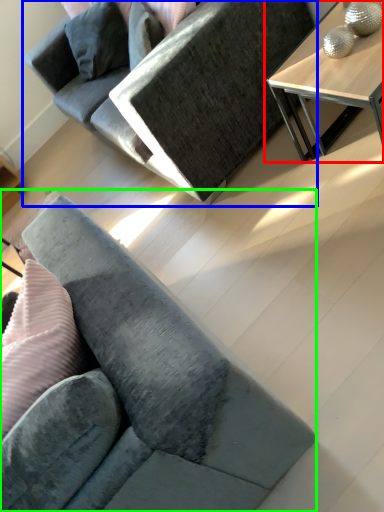
Question: Based on their relative distances, which object is farther from table (highlighted by a red box)? Choose from studio couch (highlighted by a blue box) and studio couch (highlighted by a green box).

Choices:
 (A) studio couch
 (B) studio couch

Answer: (B)